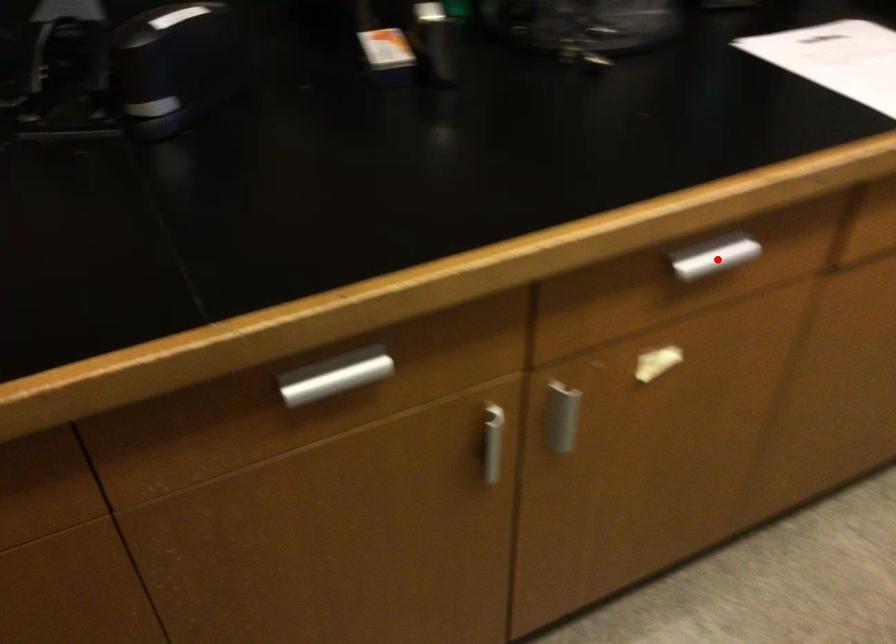
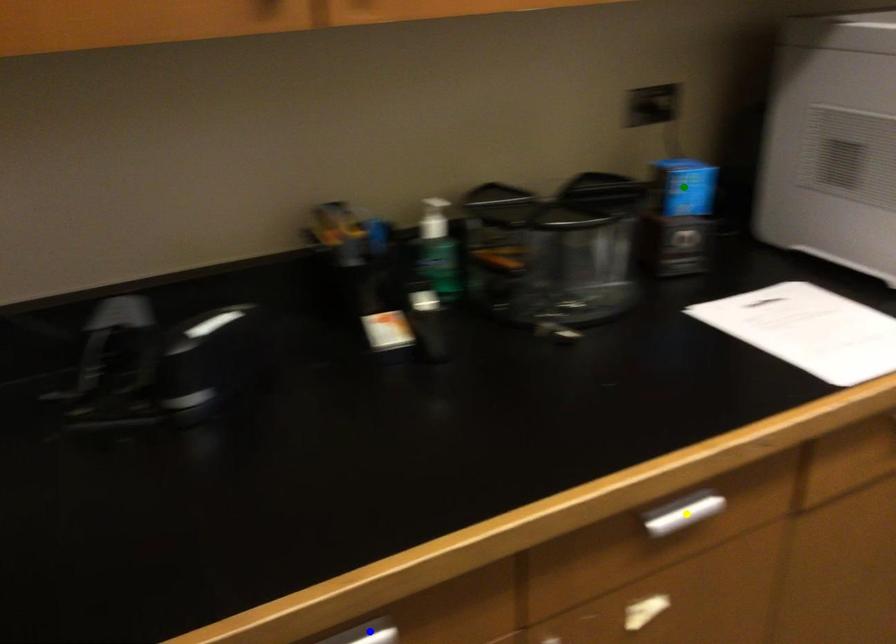
Question: I am providing you with two images of the same scene from different viewpoints. A red point is marked on the first image. You are given multiple points on the second image. Which point in image 2 represents the same 3d spot as the red point in image 1?

Choices:
 (A) green point
 (B) blue point
 (C) yellow point

Answer: (C)